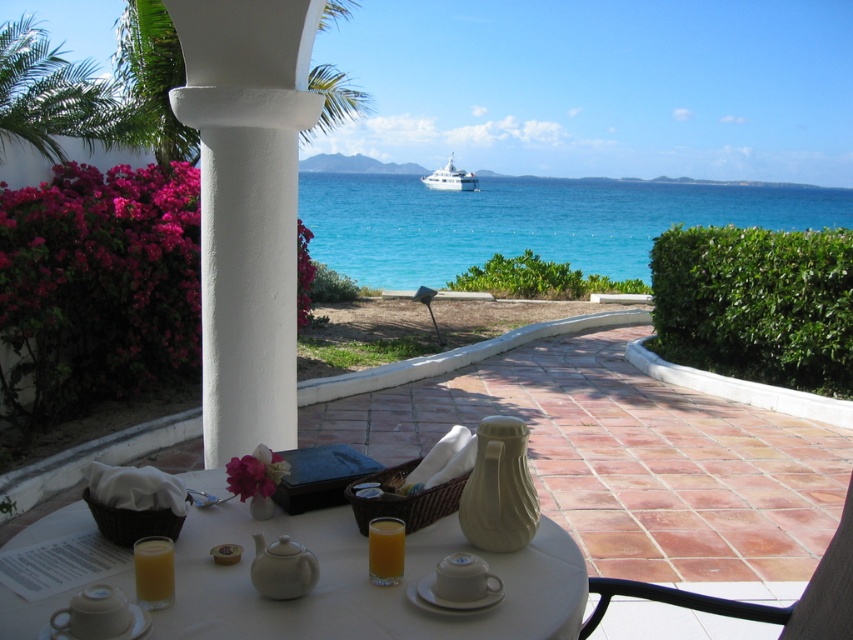
Does white stucco column at center have a greater width compared to orange translucent glass at lower left?

Correct, the width of white stucco column at center exceeds that of orange translucent glass at lower left.

Does white stucco column at center have a larger size compared to orange translucent glass at lower left?

Correct, white stucco column at center is larger in size than orange translucent glass at lower left.

This screenshot has height=640, width=853. In order to click on white stucco column at center in this screenshot , I will do `click(247, 208)`.

Can you confirm if brown leather chair at lower right is bigger than orange liquid at center?

Correct, brown leather chair at lower right is larger in size than orange liquid at center.

Who is more distant from viewer, (753, 604) or (381, 548)?

The point (753, 604) is more distant.

Between point (772, 612) and point (387, 554), which one is positioned behind?

Point (772, 612)

Locate an element on the screen. The image size is (853, 640). brown leather chair at lower right is located at coordinates (763, 604).

Where is `white ceramic table at center`? white ceramic table at center is located at coordinates (363, 584).

Who is more forward, (514, 572) or (141, 596)?

Point (141, 596) is in front.

The width and height of the screenshot is (853, 640). What are the coordinates of `white ceramic table at center` in the screenshot? It's located at (363, 584).